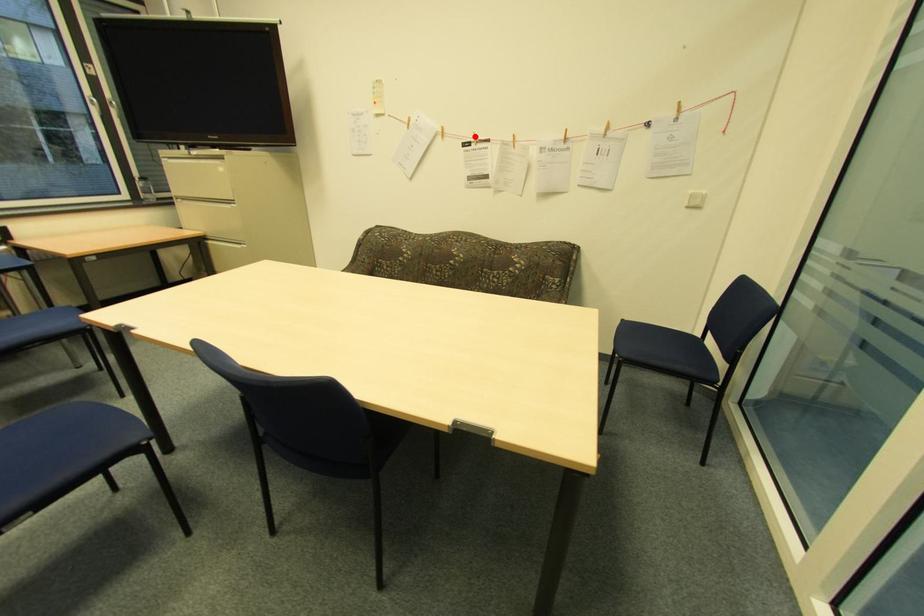
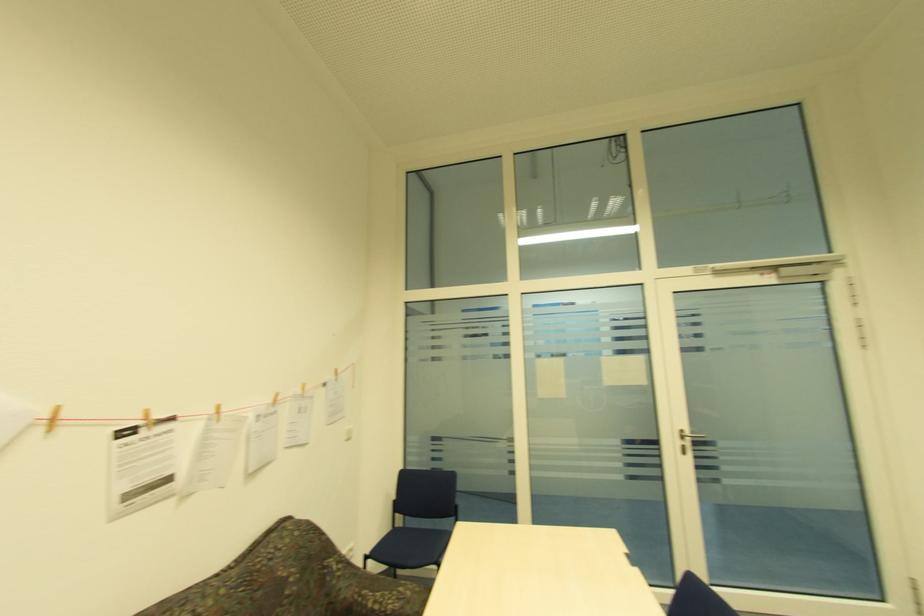
Question: I am providing you with two images of the same scene from different viewpoints. Image1 has a red point marked. In image2, the corresponding 3D location appears at what relative position? Reply with the corresponding letter.

Choices:
 (A) Closer
 (B) Farther

Answer: (B)